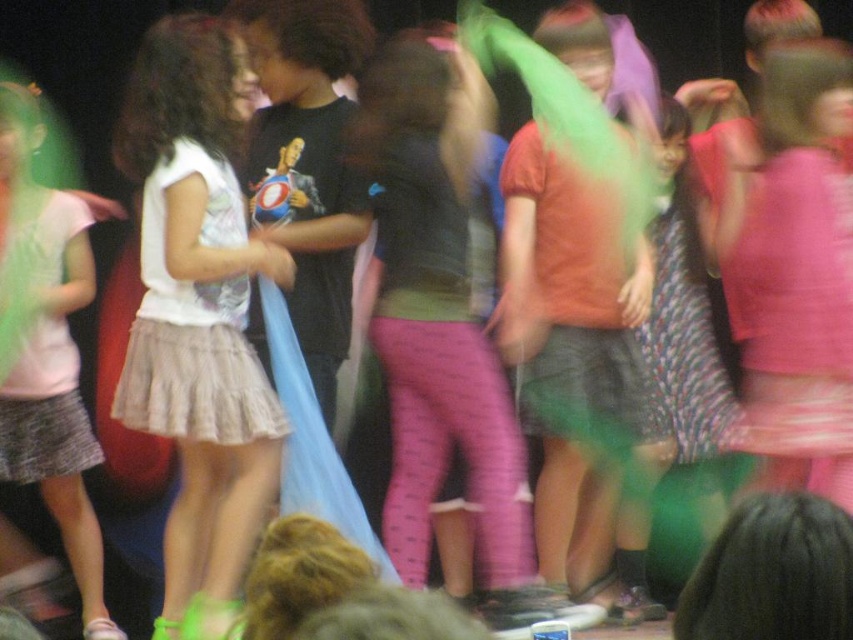
Question: Which of the following is the farthest from the observer?

Choices:
 (A) matte white skirt at left
 (B) white matte skirt at left

Answer: (A)

Question: Is white matte skirt at left to the left of matte white skirt at left from the viewer's perspective?

Choices:
 (A) yes
 (B) no

Answer: (B)

Question: Is white matte skirt at left bigger than matte white skirt at left?

Choices:
 (A) no
 (B) yes

Answer: (A)

Question: Does white matte skirt at left appear on the right side of matte white skirt at left?

Choices:
 (A) yes
 (B) no

Answer: (A)